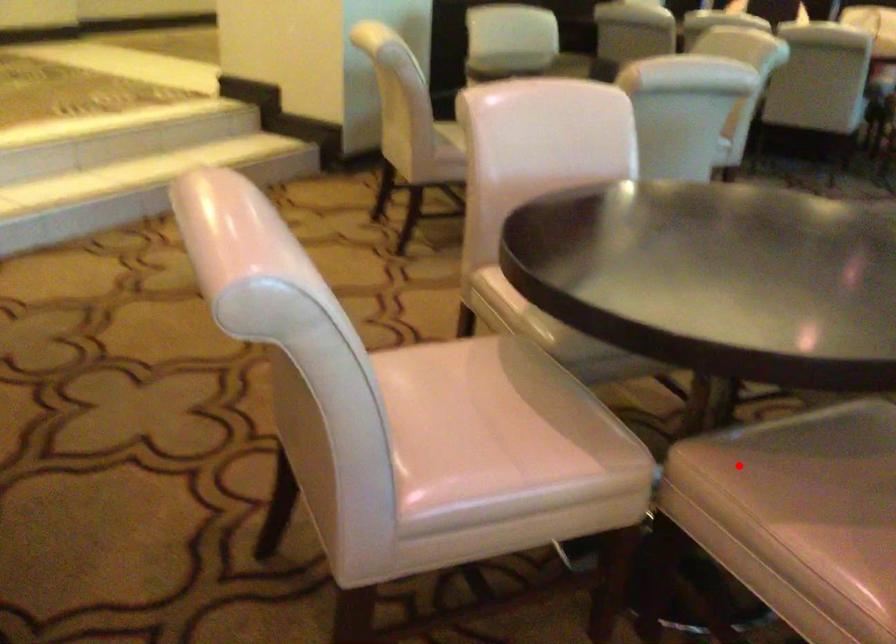
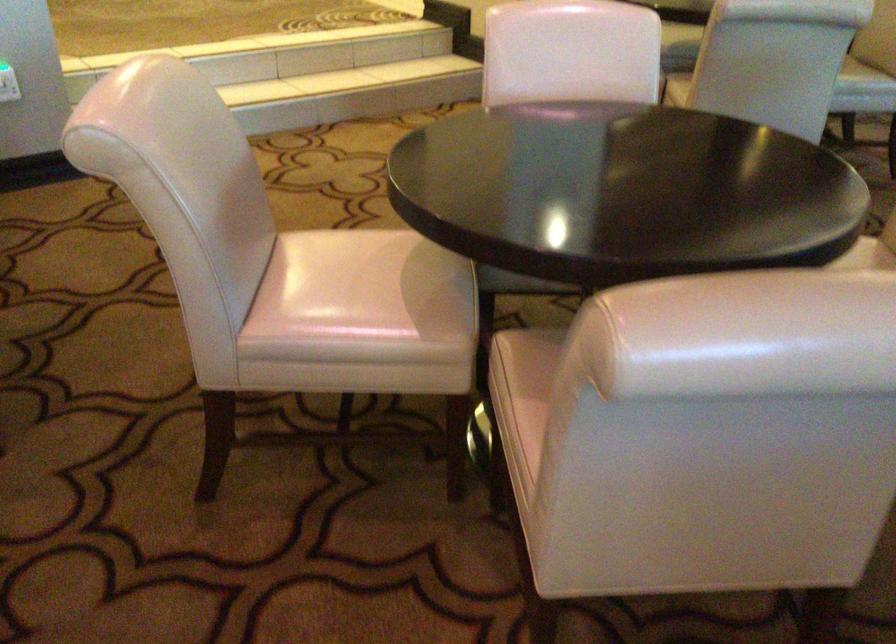
Locate, in the second image, the point that corresponds to the highlighted location in the first image.

(538, 351)